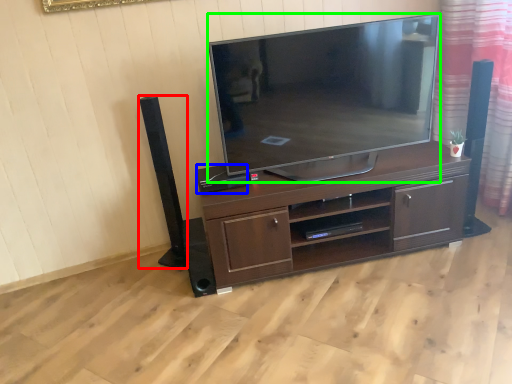
Question: Which object is positioned closest to speaker (highlighted by a red box)? Select from speaker (highlighted by a blue box) and television (highlighted by a green box).

Choices:
 (A) speaker
 (B) television

Answer: (A)